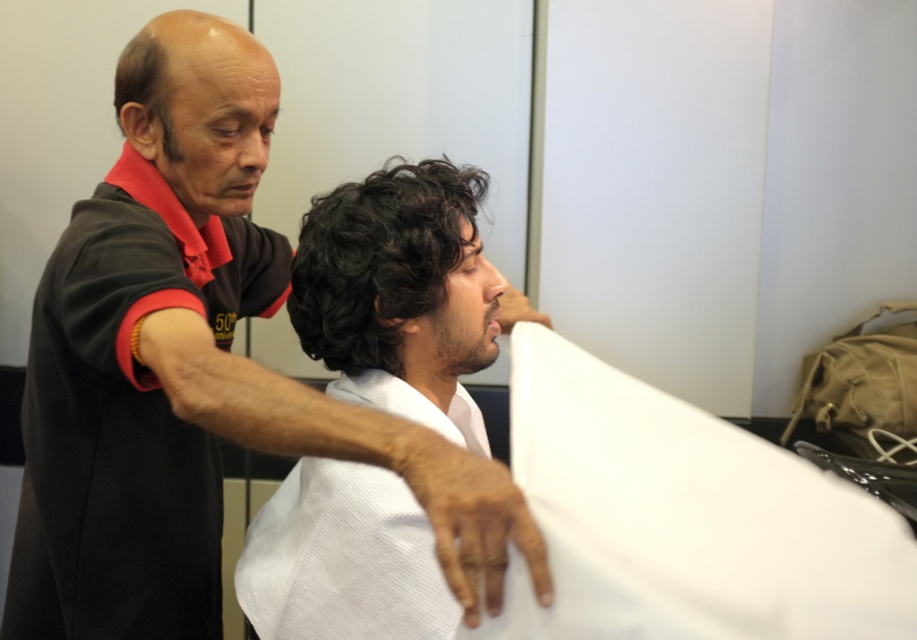
Question: Based on their relative distances, which object is nearer to the dark brown hair at upper left?

Choices:
 (A) white textured cloth at center
 (B) black curly hair at center

Answer: (B)

Question: Does white textured cloth at center appear over black curly hair at center?

Choices:
 (A) no
 (B) yes

Answer: (A)

Question: Which of these objects is positioned closest to the white cotton robe at upper center?

Choices:
 (A) black curly hair at center
 (B) white textured cloth at center
 (C) dark brown hair at upper left
 (D) black matte shirt at upper left

Answer: (D)

Question: Based on their relative distances, which object is farther from the black curly hair at center?

Choices:
 (A) black matte shirt at upper left
 (B) dark brown hair at upper left

Answer: (B)

Question: Does black matte shirt at upper left have a larger size compared to white cotton robe at upper center?

Choices:
 (A) yes
 (B) no

Answer: (A)

Question: Is white cotton robe at upper center wider than white cloth at center?

Choices:
 (A) no
 (B) yes

Answer: (A)